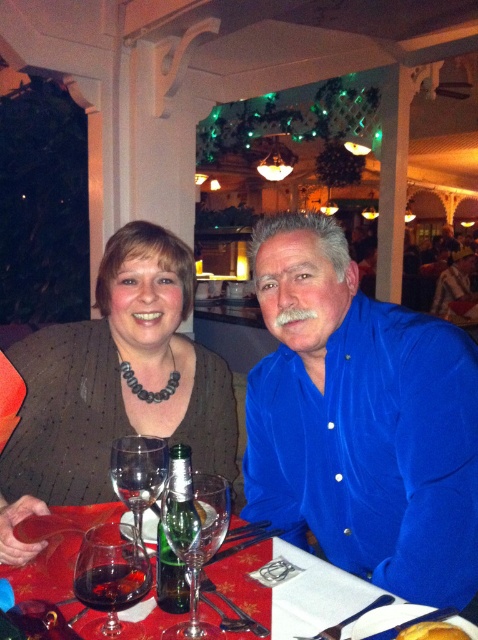
You are a server in this restaurant and need to place a dessert menu on the table. The menu is 12 inches wide. The table has a red fabric tablecloth at center. Can you fit the dessert menu on the table without overlapping the edges?

The red fabric tablecloth at center is located at point [245,579], but this coordinate does not provide information about the table size. Since the tablecloth is at the center, it is likely covering the entire table. Assuming the tablecloth is appropriately sized for the table, the dessert menu of 12 inches should fit without overlapping the edges.

You are standing at the center of the room and want to move towards the point labeled as point (54, 577). However, there is an obstacle at point (149, 573). Based on their positions, can you reach the target point without going around the obstacle?

Since point (54, 577) is behind point (149, 573), you cannot reach the target point without going around the obstacle at point (149, 573).